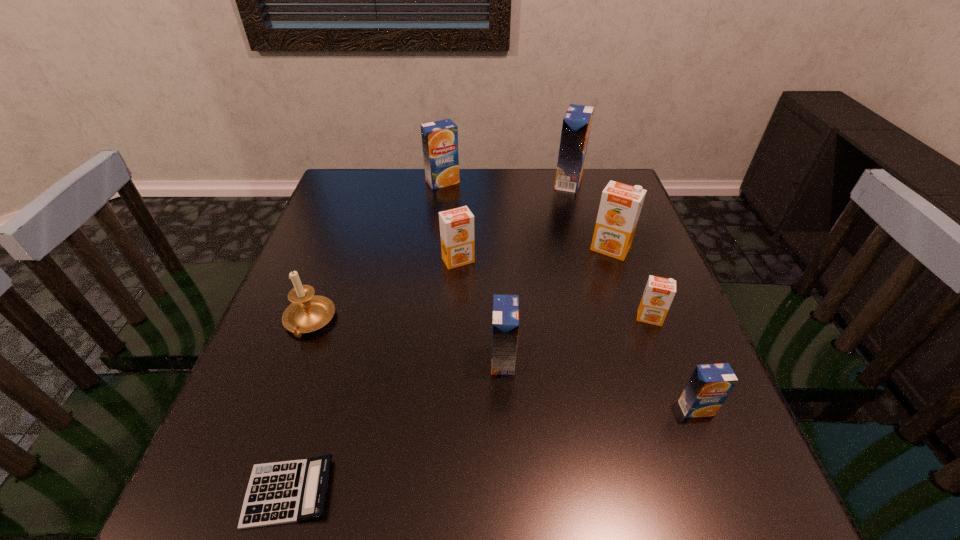
I want to click on vacant space that's between the biggest blue orange_juice and the leftmost orange orange juice, so click(514, 221).

Find the location of `vacant space that's between the leftmost blue orange_juice and the fifth object from right to left`. vacant space that's between the leftmost blue orange_juice and the fifth object from right to left is located at coordinates (473, 271).

Identify which object is located as the fifth nearest to the nearest orange orange juice. Please provide its 2D coordinates. Your answer should be formatted as a tuple, i.e. [(x, y)], where the tuple contains the x and y coordinates of a point satisfying the conditions above.

[(576, 125)]

Point out which object is positioned as the third nearest to the leftmost blue orange_juice. Please provide its 2D coordinates. Your answer should be formatted as a tuple, i.e. [(x, y)], where the tuple contains the x and y coordinates of a point satisfying the conditions above.

[(620, 206)]

Where is `orange juice identified as the third closest to the leftmost blue orange_juice`? This screenshot has height=540, width=960. orange juice identified as the third closest to the leftmost blue orange_juice is located at coordinates pyautogui.click(x=620, y=206).

You are a GUI agent. You are given a task and a screenshot of the screen. Output one action in this format:
    pyautogui.click(x=<x>, y=<y>)
    Task: Click on the orange juice that can be found as the second closest to the candle holder
    The image size is (960, 540).
    Given the screenshot: What is the action you would take?
    pyautogui.click(x=505, y=328)

You are a GUI agent. You are given a task and a screenshot of the screen. Output one action in this format:
    pyautogui.click(x=<x>, y=<y>)
    Task: Click on the blue orange_juice that is the second nearest to the beige candle holder
    The height and width of the screenshot is (540, 960).
    Given the screenshot: What is the action you would take?
    pyautogui.click(x=440, y=138)

At what (x,y) coordinates should I click in order to perform the action: click on blue orange_juice that is the fourth closest to the leftmost orange orange juice. Please return your answer as a coordinate pair (x, y). Image resolution: width=960 pixels, height=540 pixels. Looking at the image, I should click on (708, 387).

Identify which orange orange juice is the third nearest to the nearest object. Please provide its 2D coordinates. Your answer should be formatted as a tuple, i.e. [(x, y)], where the tuple contains the x and y coordinates of a point satisfying the conditions above.

[(620, 206)]

This screenshot has width=960, height=540. Find the location of `orange orange juice that is the closest to the biggest orange orange juice`. orange orange juice that is the closest to the biggest orange orange juice is located at coordinates (659, 292).